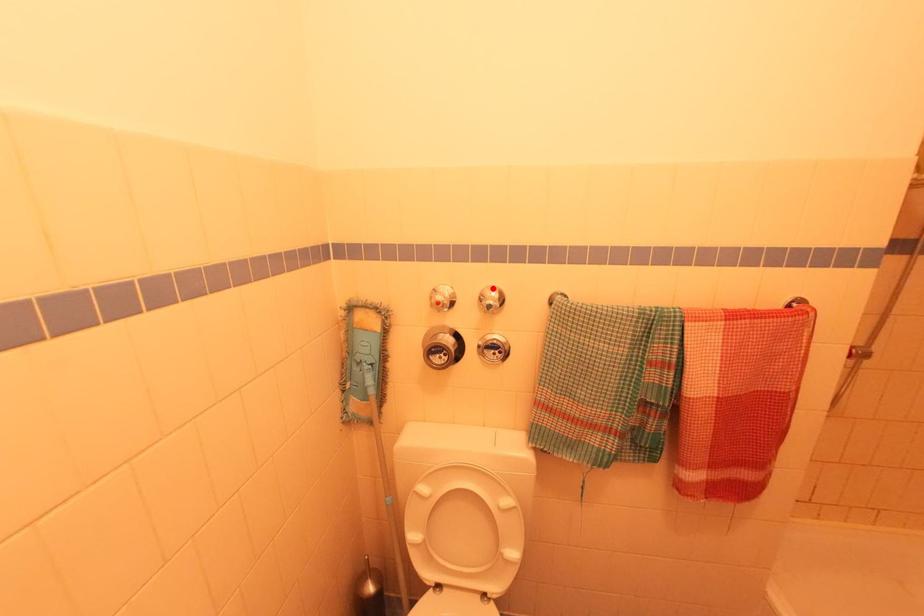
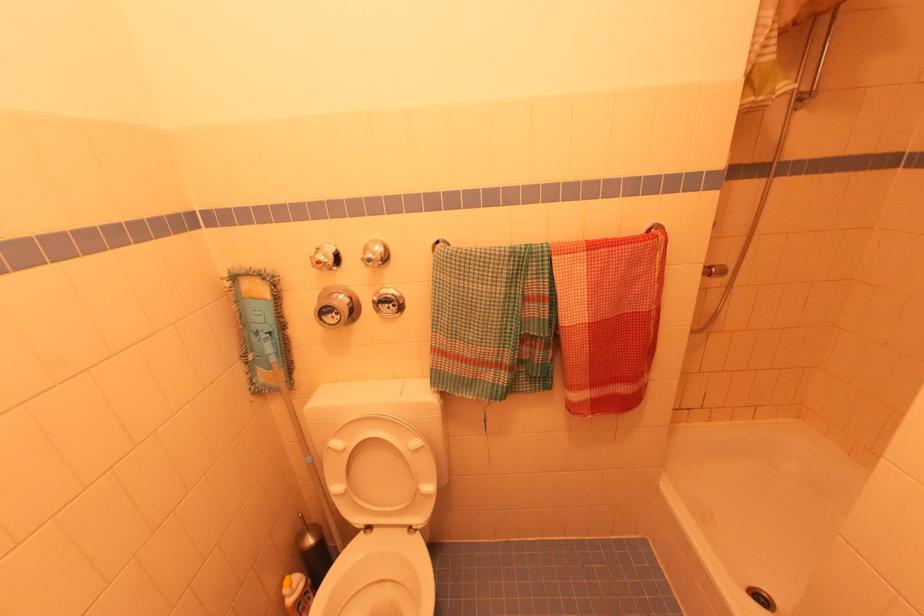
In the second image, find the point that corresponds to the highlighted location in the first image.

(377, 243)